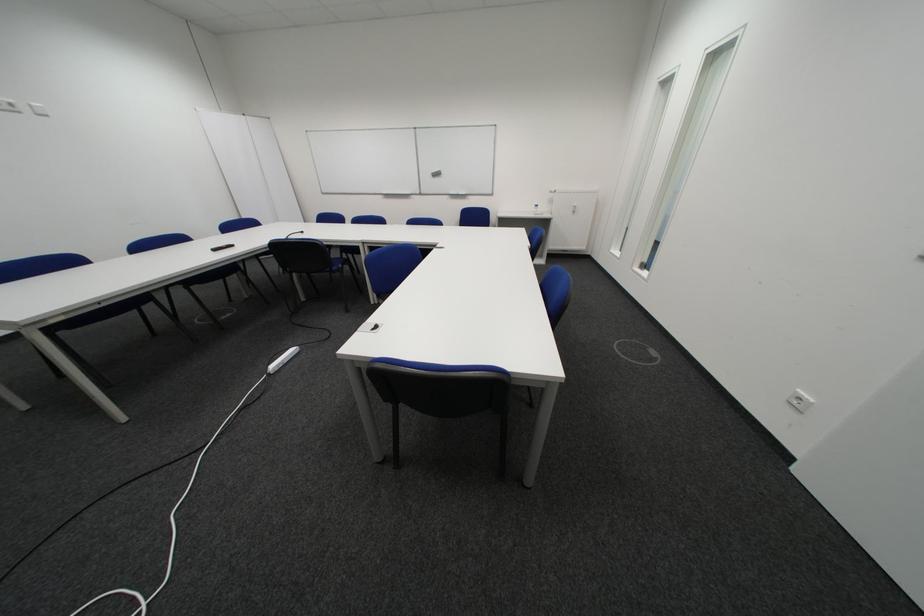
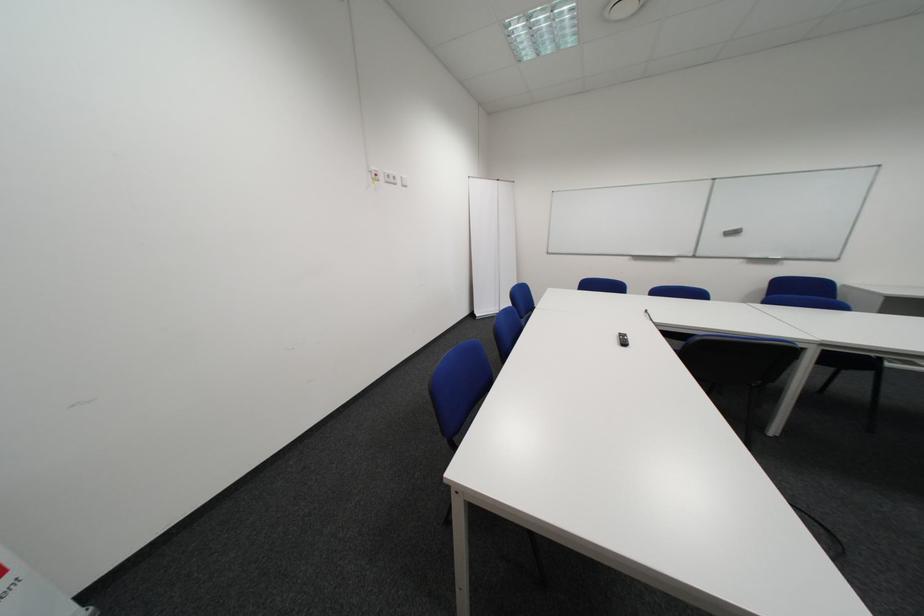
Find the pixel in the second image that matches the point at 440,171 in the first image.

(728, 228)